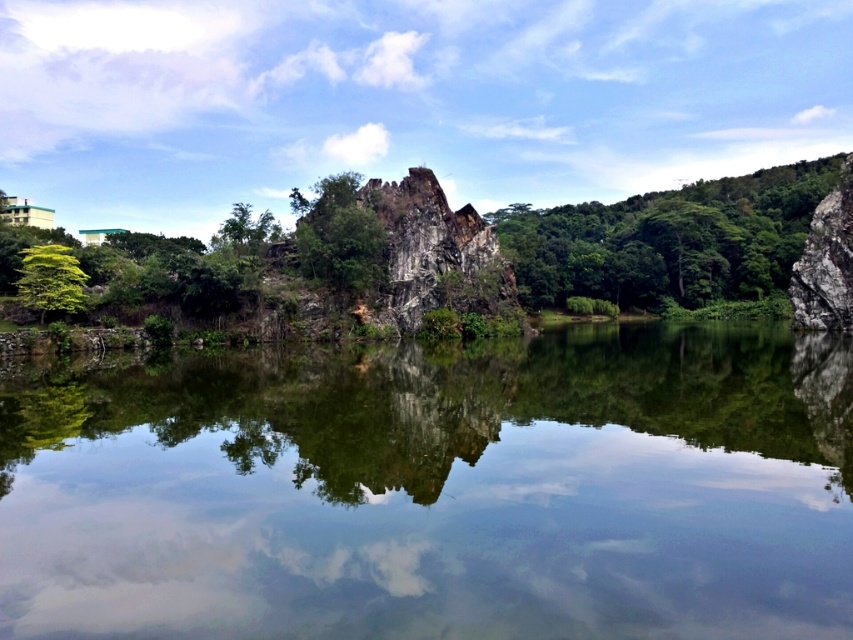
Which of these two, green leafy tree at center or green rough rock at center, stands shorter?

Standing shorter between the two is green rough rock at center.

Who is more forward, (596, 221) or (315, 253)?

Point (315, 253) is in front.

At what (x,y) coordinates should I click in order to perform the action: click on green leafy tree at center. Please return your answer as a coordinate pair (x, y). The height and width of the screenshot is (640, 853). Looking at the image, I should click on (668, 241).

Does green reflective water at center lie in front of green rough rock at center?

Yes.

Between green reflective water at center and green rough rock at center, which one appears on the left side from the viewer's perspective?

Positioned to the left is green rough rock at center.

What do you see at coordinates (439, 492) in the screenshot?
I see `green reflective water at center` at bounding box center [439, 492].

Where is `green reflective water at center`? green reflective water at center is located at coordinates pos(439,492).

Which is below, green leafy tree at center or green leafy tree at left?

green leafy tree at left

Is green leafy tree at center smaller than green leafy tree at left?

No.

The width and height of the screenshot is (853, 640). What do you see at coordinates (668, 241) in the screenshot?
I see `green leafy tree at center` at bounding box center [668, 241].

This screenshot has width=853, height=640. Identify the location of green leafy tree at center. (668, 241).